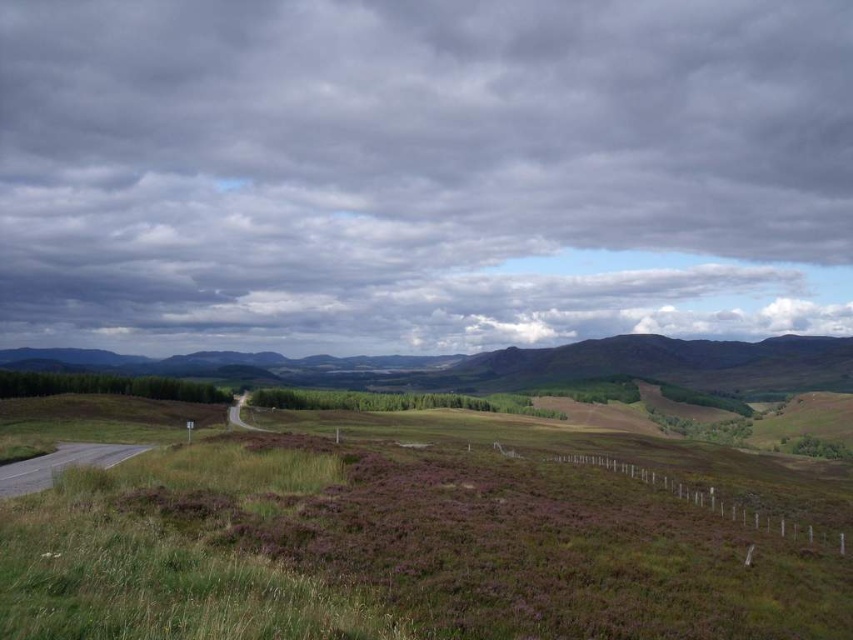
You are standing on the road and looking towards the fence. Which object is positioned to the left of the other between the cloudy sky at upper center and the green grassy field at lower left?

The cloudy sky at upper center is to the left of the green grassy field at lower left according to the description.